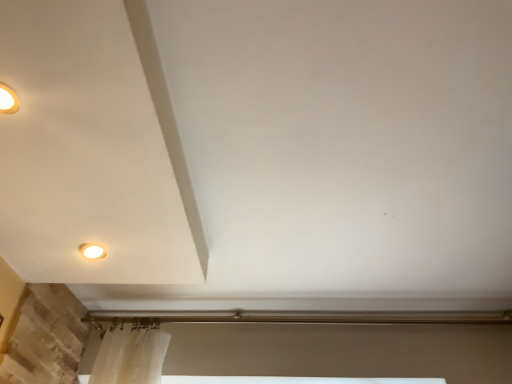
Question: Should I look upward or downward to see matte white lamp at lower left?

Choices:
 (A) up
 (B) down

Answer: (B)

Question: Considering the relative positions of matte white lamp at lower left and white glossy light fixture at upper left in the image provided, is matte white lamp at lower left to the right of white glossy light fixture at upper left from the viewer's perspective?

Choices:
 (A) no
 (B) yes

Answer: (B)

Question: Is matte white lamp at lower left further to camera compared to white glossy light fixture at upper left?

Choices:
 (A) yes
 (B) no

Answer: (A)

Question: Considering the relative positions of matte white lamp at lower left and white glossy light fixture at upper left in the image provided, is matte white lamp at lower left in front of white glossy light fixture at upper left?

Choices:
 (A) yes
 (B) no

Answer: (B)

Question: Considering the relative sizes of matte white lamp at lower left and white glossy light fixture at upper left in the image provided, is matte white lamp at lower left smaller than white glossy light fixture at upper left?

Choices:
 (A) no
 (B) yes

Answer: (B)

Question: Are matte white lamp at lower left and white glossy light fixture at upper left beside each other?

Choices:
 (A) yes
 (B) no

Answer: (B)

Question: Is matte white lamp at lower left to the left of white glossy light fixture at upper left from the viewer's perspective?

Choices:
 (A) yes
 (B) no

Answer: (B)

Question: Is white glossy light fixture at upper left next to matte white lamp at lower left?

Choices:
 (A) yes
 (B) no

Answer: (B)

Question: From a real-world perspective, is white glossy light fixture at upper left below matte white lamp at lower left?

Choices:
 (A) yes
 (B) no

Answer: (A)

Question: Considering the relative positions of white glossy light fixture at upper left and matte white lamp at lower left in the image provided, is white glossy light fixture at upper left to the left of matte white lamp at lower left from the viewer's perspective?

Choices:
 (A) no
 (B) yes

Answer: (B)

Question: Could you tell me if white glossy light fixture at upper left is facing matte white lamp at lower left?

Choices:
 (A) yes
 (B) no

Answer: (B)

Question: Would you say white glossy light fixture at upper left is outside matte white lamp at lower left?

Choices:
 (A) yes
 (B) no

Answer: (A)

Question: Is white glossy light fixture at upper left positioned behind matte white lamp at lower left?

Choices:
 (A) no
 (B) yes

Answer: (A)

Question: Looking at the image, does matte white lamp at lower left seem bigger or smaller compared to white glossy light fixture at upper left?

Choices:
 (A) big
 (B) small

Answer: (B)